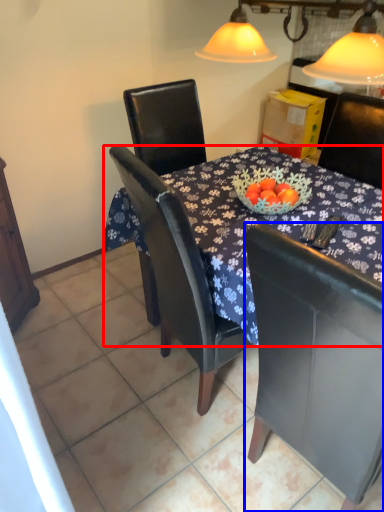
Question: Among these objects, which one is nearest to the camera, desk (highlighted by a red box) or chair (highlighted by a blue box)?

Choices:
 (A) desk
 (B) chair

Answer: (B)